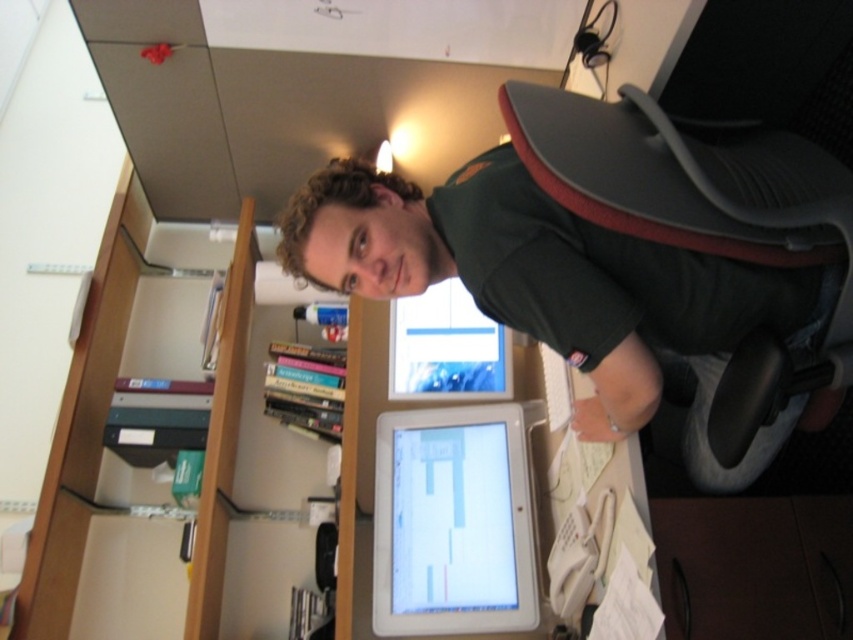
Between wooden at left and matte plastic monitor at center, which one has more height?

With more height is wooden at left.

Is point (239, 365) positioned in front of point (444, 314)?

No, (239, 365) is further to viewer.

I want to click on wooden at left, so click(80, 422).

Image resolution: width=853 pixels, height=640 pixels. In order to click on white glossy tablet at center in this screenshot , I will do `click(454, 522)`.

Does point (527, 428) come closer to viewer compared to point (235, 403)?

Yes, it is.

Is point (404, 596) closer to camera compared to point (137, 243)?

Yes, it is.

The height and width of the screenshot is (640, 853). I want to click on white glossy tablet at center, so click(x=454, y=522).

Does white glossy tablet at center have a lesser height compared to matte plastic monitor at center?

No, white glossy tablet at center is not shorter than matte plastic monitor at center.

You are a GUI agent. You are given a task and a screenshot of the screen. Output one action in this format:
    pyautogui.click(x=<x>, y=<y>)
    Task: Click on the white glossy tablet at center
    
    Given the screenshot: What is the action you would take?
    pyautogui.click(x=454, y=522)